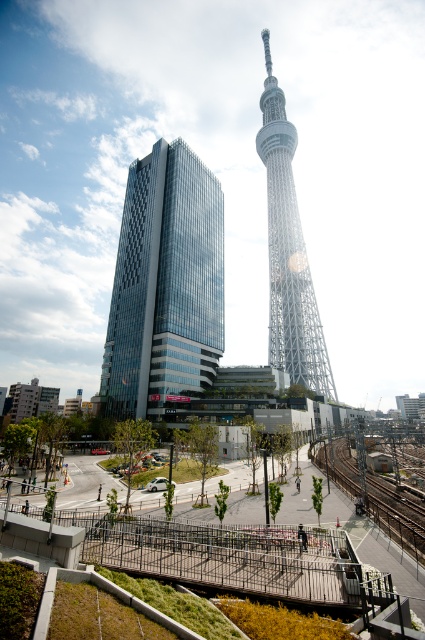
Is glassy modern building at center positioned before metal train track at lower center?

No, glassy modern building at center is further to the viewer.

Is glassy modern building at center thinner than metal train track at lower center?

Incorrect, glassy modern building at center's width is not less than metal train track at lower center's.

The image size is (425, 640). What do you see at coordinates (164, 284) in the screenshot? I see `glassy modern building at center` at bounding box center [164, 284].

At what (x,y) coordinates should I click in order to perform the action: click on glassy modern building at center. Please return your answer as a coordinate pair (x, y). The image size is (425, 640). Looking at the image, I should click on (164, 284).

Who is higher up, glassy modern building at center or white lattice tower at center?

Positioned higher is white lattice tower at center.

Does glassy modern building at center have a smaller size compared to white lattice tower at center?

Correct, glassy modern building at center occupies less space than white lattice tower at center.

Which is behind, point (150, 256) or point (306, 368)?

The point (306, 368) is behind.

Find the location of a particular element. This screenshot has width=425, height=640. glassy modern building at center is located at coordinates (164, 284).

Which is above, white lattice tower at center or metal train track at lower center?

Positioned higher is white lattice tower at center.

Between point (291, 211) and point (380, 508), which one is positioned in front?

Point (380, 508)

Where is `white lattice tower at center`? Image resolution: width=425 pixels, height=640 pixels. white lattice tower at center is located at coordinates (289, 252).